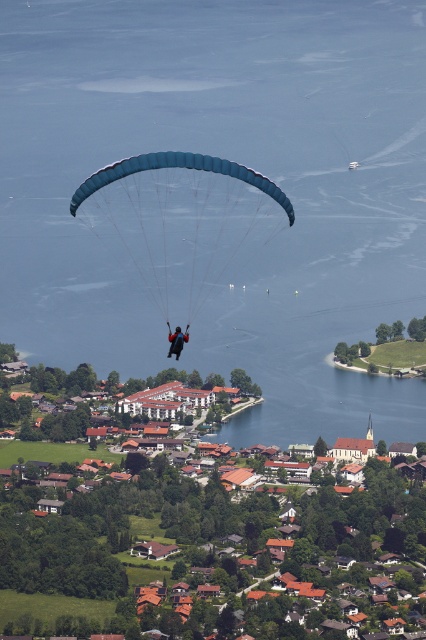
You are a photographer trying to capture the paraglider and the lake in the same frame. Given that your camera has a maximum zoom range of 100 meters, can you confirm if both the blue water at center and the blue fabric parachute at center will fit into the frame?

The blue water at center and blue fabric parachute at center are 22.43 meters apart from each other, so yes, both will fit into the frame since the distance between them is within the camera zoom range of 100 meters.

You are a pilot in a paraglider and see the blue water at center and brown tiled roofs at center below you. Which object is closer to your current position?

The blue water at center is closer to your current position because it is above the brown tiled roofs at center.